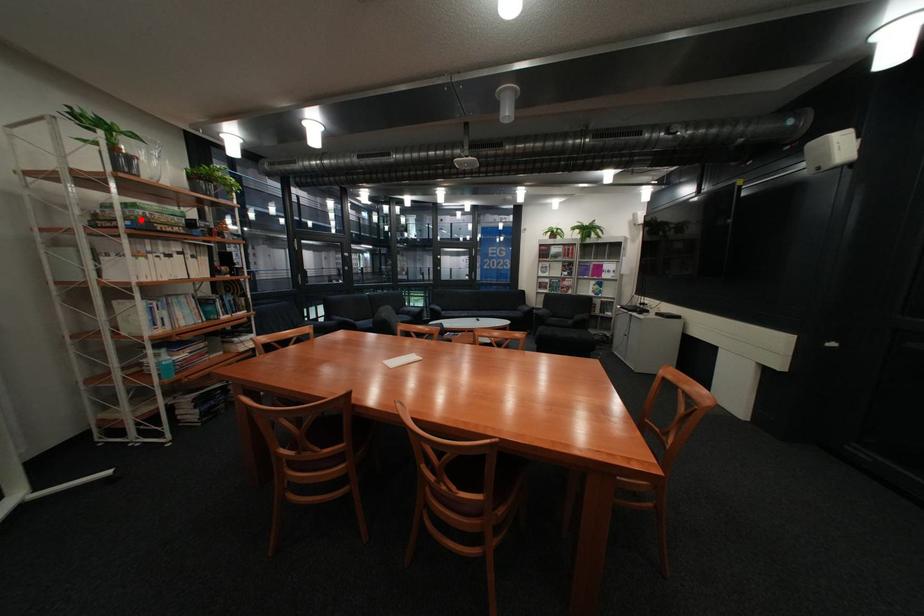
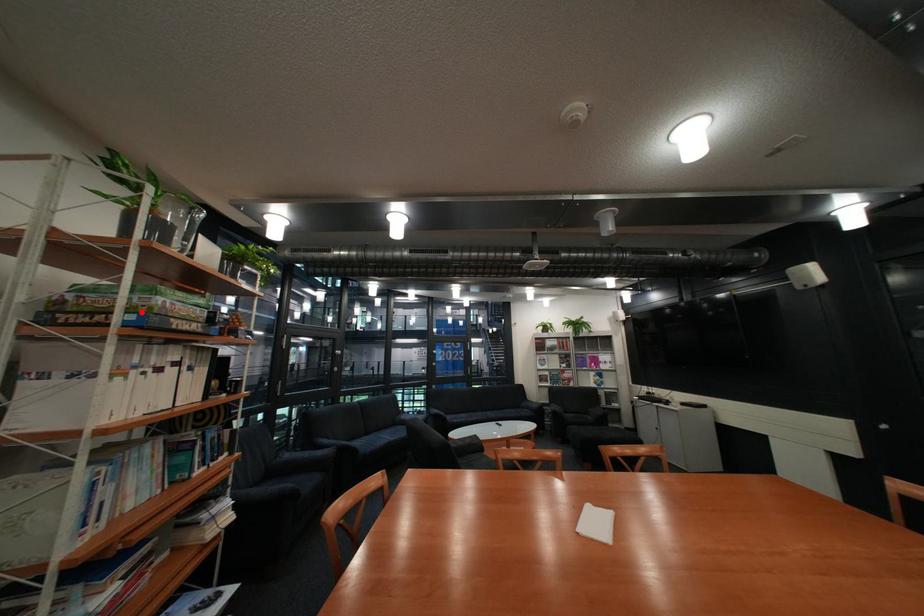
I am providing you with two images of the same scene from different viewpoints. A red point is marked on the first image and another point is marked on the second image. Are the points marked in image1 and image2 representing the same 3D position?

Yes